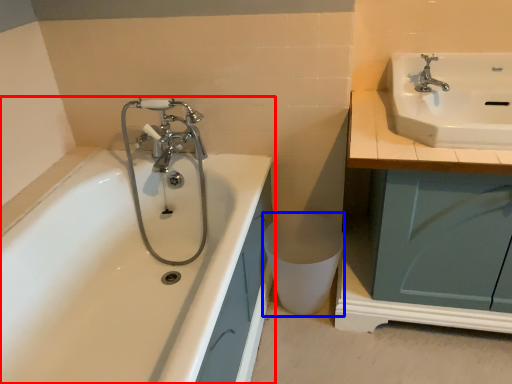
Question: Among these objects, which one is farthest to the camera, bathtub (highlighted by a red box) or toilet bowl (highlighted by a blue box)?

Choices:
 (A) bathtub
 (B) toilet bowl

Answer: (B)